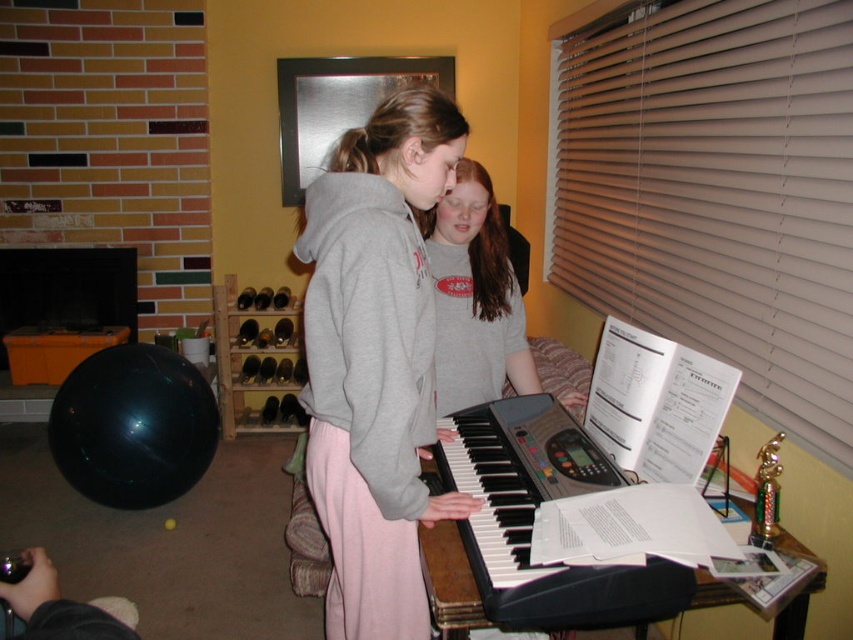
Can you confirm if black plastic keyboard at center is bigger than gray cotton shirt at center?

Yes.

Which is in front, point (589, 586) or point (569, 397)?

Point (589, 586) is in front.

Where is `black plastic keyboard at center`? The width and height of the screenshot is (853, 640). black plastic keyboard at center is located at coordinates (532, 516).

What are the coordinates of `beige blinds at upper right` in the screenshot? It's located at (718, 193).

What do you see at coordinates (718, 193) in the screenshot? This screenshot has height=640, width=853. I see `beige blinds at upper right` at bounding box center [718, 193].

Where is `beige blinds at upper right`? This screenshot has width=853, height=640. beige blinds at upper right is located at coordinates (x=718, y=193).

Image resolution: width=853 pixels, height=640 pixels. In order to click on beige blinds at upper right in this screenshot , I will do `click(718, 193)`.

Between gray sweatshirt at center and black plastic keyboard at center, which one is positioned higher?

gray sweatshirt at center is above.

Who is more forward, (311, 192) or (461, 460)?

Point (311, 192) is in front.

Between point (447, 115) and point (659, 605), which one is positioned behind?

Positioned behind is point (447, 115).

At what (x,y) coordinates should I click in order to perform the action: click on gray sweatshirt at center. Please return your answer as a coordinate pair (x, y). Image resolution: width=853 pixels, height=640 pixels. Looking at the image, I should click on (375, 360).